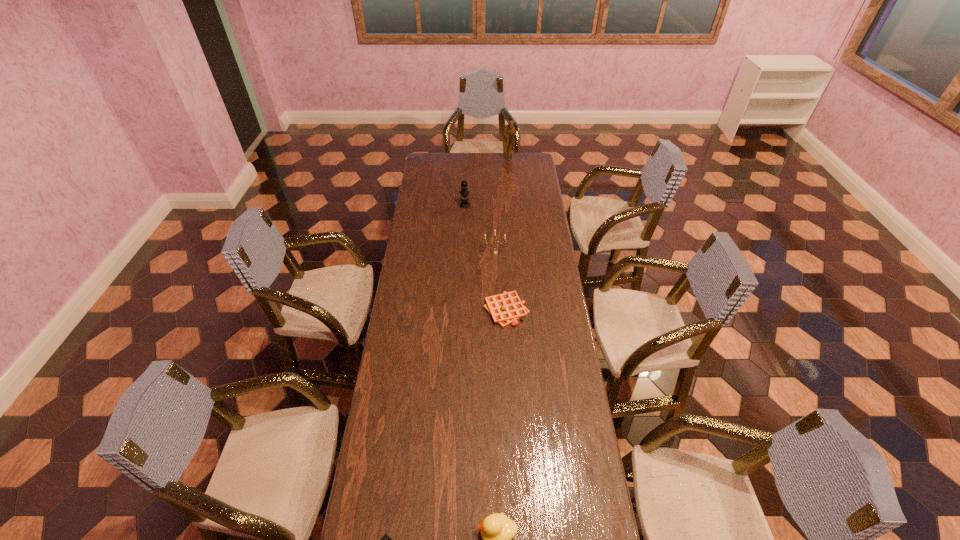
Where is `free space between the second shortest object and the microphone`? free space between the second shortest object and the microphone is located at coordinates (486, 258).

The width and height of the screenshot is (960, 540). I want to click on object that is the third closest to the third shortest object, so click(494, 251).

The height and width of the screenshot is (540, 960). Identify the location of the closest object relative to the fourth tallest object. (385, 539).

Identify the location of vacant space that satisfies the following two spatial constraints: 1. on the front side of the fifth object from right to left; 2. on the left side of the waffle. This screenshot has width=960, height=540. (461, 310).